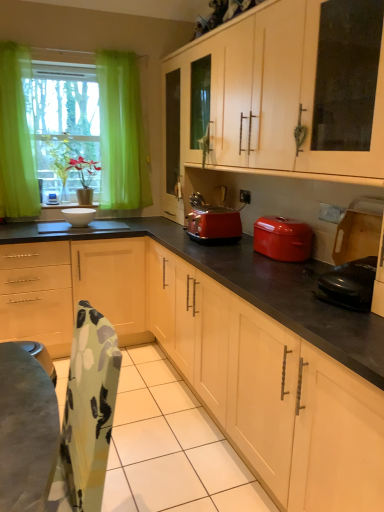
Question: Considering the relative positions of shiny red toaster at center and green sheer curtain at left in the image provided, is shiny red toaster at center to the left of green sheer curtain at left from the viewer's perspective?

Choices:
 (A) yes
 (B) no

Answer: (B)

Question: Is shiny red toaster at center wider than green sheer curtain at left?

Choices:
 (A) yes
 (B) no

Answer: (A)

Question: From the image's perspective, does shiny red toaster at center appear lower than green sheer curtain at left?

Choices:
 (A) no
 (B) yes

Answer: (B)

Question: Is shiny red toaster at center smaller than green sheer curtain at left?

Choices:
 (A) yes
 (B) no

Answer: (A)

Question: From the image's perspective, is shiny red toaster at center above green sheer curtain at left?

Choices:
 (A) no
 (B) yes

Answer: (A)

Question: From a real-world perspective, is shiny red toaster at center located higher than green sheer curtain at left?

Choices:
 (A) no
 (B) yes

Answer: (A)

Question: Is matte wood cabinets at center, the 1th cabinetry when ordered from bottom to top, facing towards white glossy bowl at center, which is counted as the 1th appliance, starting from the back?

Choices:
 (A) yes
 (B) no

Answer: (A)

Question: Is matte wood cabinets at center, acting as the second cabinetry starting from the top, with white glossy bowl at center, which is counted as the 1th appliance, starting from the back?

Choices:
 (A) yes
 (B) no

Answer: (B)

Question: Are matte wood cabinets at center, acting as the second cabinetry starting from the top, and white glossy bowl at center, positioned as the second appliance in right-to-left order, located far from each other?

Choices:
 (A) no
 (B) yes

Answer: (B)

Question: Is matte wood cabinets at center, the 1th cabinetry when ordered from bottom to top, further to the viewer compared to white glossy bowl at center, the second appliance from the bottom?

Choices:
 (A) no
 (B) yes

Answer: (A)

Question: Can white glossy bowl at center, the second appliance from the bottom, be found inside matte wood cabinets at center, the 1th cabinetry when ordered from bottom to top?

Choices:
 (A) yes
 (B) no

Answer: (B)

Question: From the image's perspective, is matte wood cabinets at center, the 1th cabinetry when ordered from bottom to top, located beneath white glossy bowl at center, the first appliance when ordered from top to bottom?

Choices:
 (A) yes
 (B) no

Answer: (A)

Question: Is matte wood cabinets at center, the 1th cabinetry when ordered from bottom to top, located outside green sheer curtain at left?

Choices:
 (A) yes
 (B) no

Answer: (A)